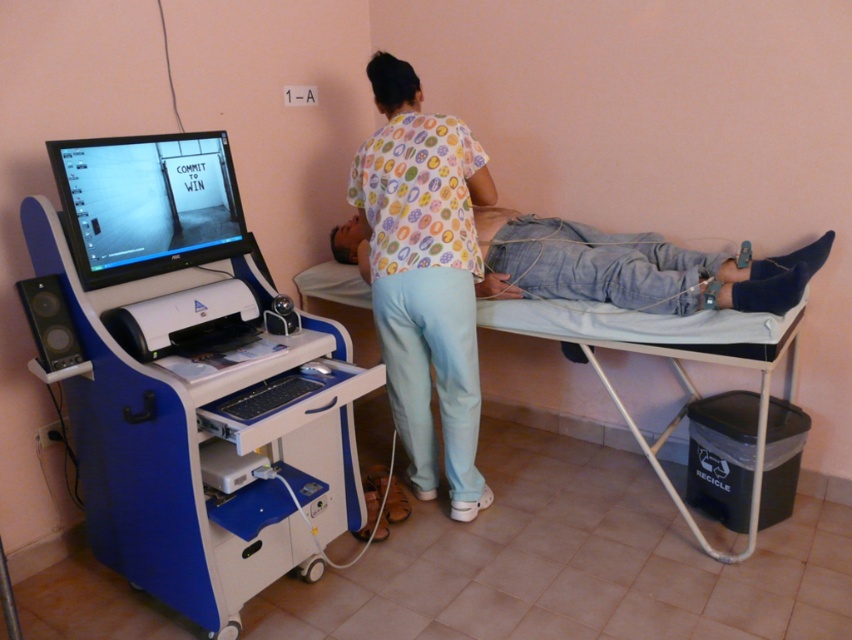
Question: Based on their relative distances, which object is nearer to the blue fabric bed at center?

Choices:
 (A) blue plastic cart at left
 (B) black glossy monitor at left

Answer: (A)

Question: Can you confirm if blue plastic cart at left is positioned to the left of printed fabric shirt at center?

Choices:
 (A) yes
 (B) no

Answer: (A)

Question: Which point is farther to the camera?

Choices:
 (A) (119, 230)
 (B) (404, 202)
 (C) (55, 228)

Answer: (B)

Question: In this image, where is printed fabric shirt at center located relative to blue fabric bed at center?

Choices:
 (A) below
 (B) above

Answer: (B)

Question: Does printed fabric shirt at center have a smaller size compared to black glossy monitor at left?

Choices:
 (A) yes
 (B) no

Answer: (B)

Question: Which point is closer to the camera?

Choices:
 (A) black glossy monitor at left
 (B) printed fabric shirt at center
 (C) blue fabric bed at center
 (D) blue plastic cart at left

Answer: (D)